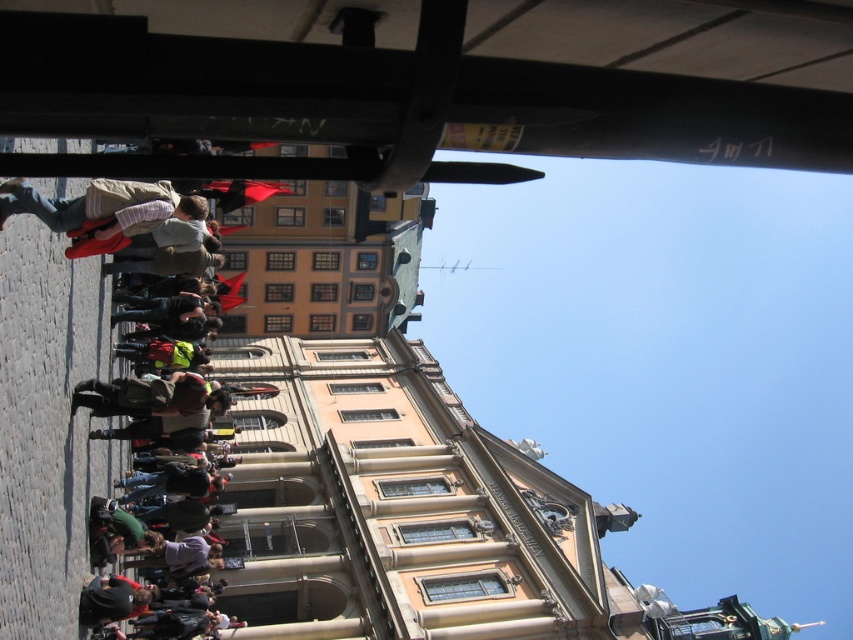
Question: Considering the relative positions of metallic black canopy at upper center and striped shirt at left in the image provided, where is metallic black canopy at upper center located with respect to striped shirt at left?

Choices:
 (A) right
 (B) left

Answer: (A)

Question: In this image, where is metallic black canopy at upper center located relative to striped shirt at left?

Choices:
 (A) above
 (B) below

Answer: (A)

Question: Which of the following is the closest to the observer?

Choices:
 (A) striped shirt at left
 (B) metallic black canopy at upper center

Answer: (B)

Question: Can you confirm if metallic black canopy at upper center is smaller than striped shirt at left?

Choices:
 (A) yes
 (B) no

Answer: (B)

Question: Among these points, which one is nearest to the camera?

Choices:
 (A) (112, 200)
 (B) (277, 136)

Answer: (B)

Question: Which object is farther from the camera taking this photo?

Choices:
 (A) metallic black canopy at upper center
 (B) striped shirt at left

Answer: (B)